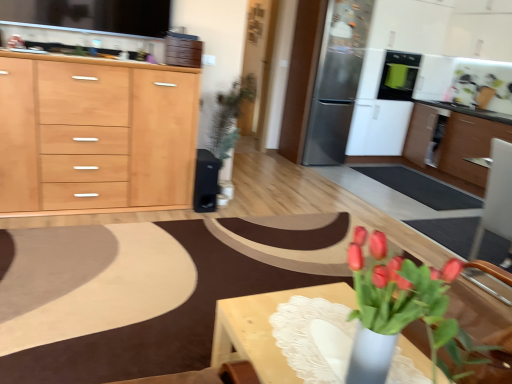
Question: Is satin silver refrigerator at upper right, which ranks as the second appliance in right-to-left order, to the left of light wood/texture cabinet at left, the 2th cabinetry in the back-to-front sequence, from the viewer's perspective?

Choices:
 (A) no
 (B) yes

Answer: (A)

Question: From the image's perspective, is satin silver refrigerator at upper right, which ranks as the second appliance in right-to-left order, on top of light wood/texture cabinet at left, which is counted as the 1th cabinetry, starting from the front?

Choices:
 (A) no
 (B) yes

Answer: (B)

Question: Are satin silver refrigerator at upper right, placed as the 2th appliance when sorted from back to front, and light wood/texture cabinet at left, the second cabinetry when ordered from right to left, located far from each other?

Choices:
 (A) yes
 (B) no

Answer: (A)

Question: Does satin silver refrigerator at upper right, which ranks as the second appliance in right-to-left order, have a smaller size compared to light wood/texture cabinet at left, the 2th cabinetry in the back-to-front sequence?

Choices:
 (A) yes
 (B) no

Answer: (A)

Question: Considering the relative sizes of satin silver refrigerator at upper right, arranged as the second appliance when viewed from the left, and light wood/texture cabinet at left, which is counted as the 1th cabinetry, starting from the front, in the image provided, is satin silver refrigerator at upper right, arranged as the second appliance when viewed from the left, wider than light wood/texture cabinet at left, which is counted as the 1th cabinetry, starting from the front,?

Choices:
 (A) yes
 (B) no

Answer: (B)

Question: Is satin silver refrigerator at upper right, which is the second appliance from front to back, closer to camera compared to light wood/texture cabinet at left, the second cabinetry when ordered from right to left?

Choices:
 (A) no
 (B) yes

Answer: (A)

Question: Is wooden table at lower right completely or partially outside of light wood/texture cabinet at left, which is counted as the 1th cabinetry, starting from the left?

Choices:
 (A) yes
 (B) no

Answer: (A)

Question: Is the position of wooden table at lower right less distant than that of light wood/texture cabinet at left, the second cabinetry when ordered from right to left?

Choices:
 (A) no
 (B) yes

Answer: (B)

Question: From the image's perspective, is wooden table at lower right above light wood/texture cabinet at left, which is counted as the 1th cabinetry, starting from the front?

Choices:
 (A) no
 (B) yes

Answer: (A)

Question: From a real-world perspective, is wooden table at lower right below light wood/texture cabinet at left, which is counted as the 1th cabinetry, starting from the front?

Choices:
 (A) yes
 (B) no

Answer: (A)

Question: Is the surface of wooden table at lower right in direct contact with light wood/texture cabinet at left, the second cabinetry when ordered from right to left?

Choices:
 (A) no
 (B) yes

Answer: (A)

Question: Would you say wooden table at lower right contains light wood/texture cabinet at left, which is counted as the 1th cabinetry, starting from the front?

Choices:
 (A) yes
 (B) no

Answer: (B)

Question: Is the depth of stainless steel refrigerator at upper right less than that of wooden table at lower right?

Choices:
 (A) yes
 (B) no

Answer: (B)